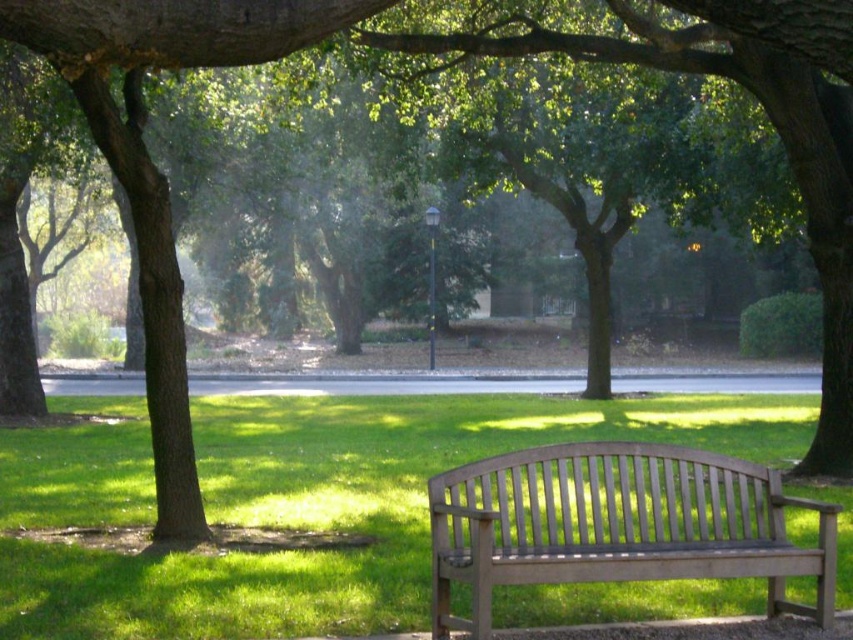
You are standing at the origin point of the park scene. Where is the green grass at center located?

The green grass at center is located at point (x=343, y=508).

You are planning to place a picnic blanket on the green grass at center near the light brown wooden bench at center. Considering the space available, will the blanket fit comfortably without overlapping the bench?

The green grass at center has a larger width than the light brown wooden bench at center, so the picnic blanket can fit comfortably on the green grass at center without overlapping the bench.